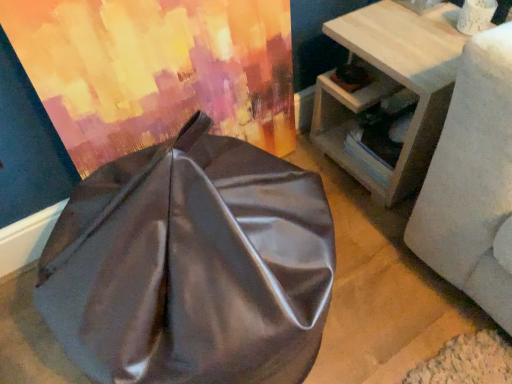
Question: Considering the relative positions of light wood side table at right and satin fabric curtain at upper left in the image provided, is light wood side table at right to the left or to the right of satin fabric curtain at upper left?

Choices:
 (A) right
 (B) left

Answer: (A)

Question: Is light wood side table at right situated inside satin fabric curtain at upper left or outside?

Choices:
 (A) outside
 (B) inside

Answer: (A)

Question: Which object is positioned closest to the light wood side table at right?

Choices:
 (A) satin gray bean bag at center
 (B) satin fabric curtain at upper left

Answer: (B)

Question: Estimate the real-world distances between objects in this image. Which object is farther from the satin fabric curtain at upper left?

Choices:
 (A) satin gray bean bag at center
 (B) light wood side table at right

Answer: (B)